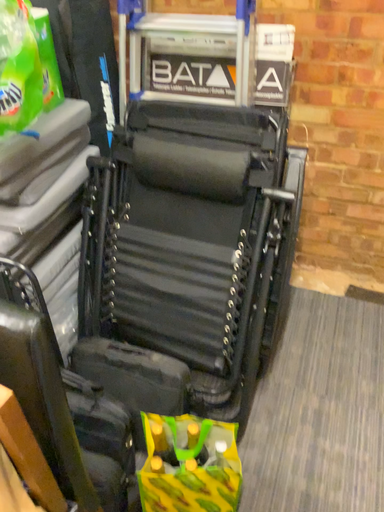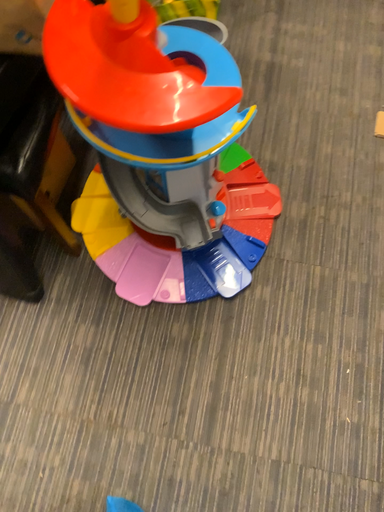
Question: How did the camera likely rotate when shooting the video?

Choices:
 (A) rotated right
 (B) rotated left

Answer: (A)